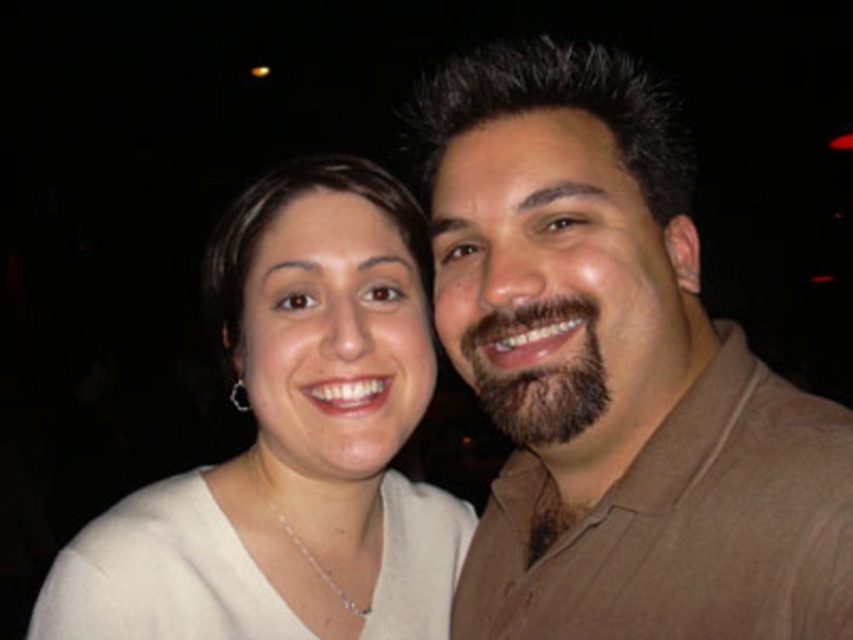
Question: Which point is closer to the camera?

Choices:
 (A) (276, 273)
 (B) (780, 624)

Answer: (B)

Question: Can you confirm if brown cotton shirt at right is positioned above white matte shirt at center?

Choices:
 (A) no
 (B) yes

Answer: (B)

Question: Which object is closer to the camera taking this photo?

Choices:
 (A) brown cotton shirt at right
 (B) white matte shirt at center

Answer: (A)

Question: Does brown cotton shirt at right come behind white matte shirt at center?

Choices:
 (A) no
 (B) yes

Answer: (A)

Question: Can you confirm if brown cotton shirt at right is bigger than white matte shirt at center?

Choices:
 (A) no
 (B) yes

Answer: (B)